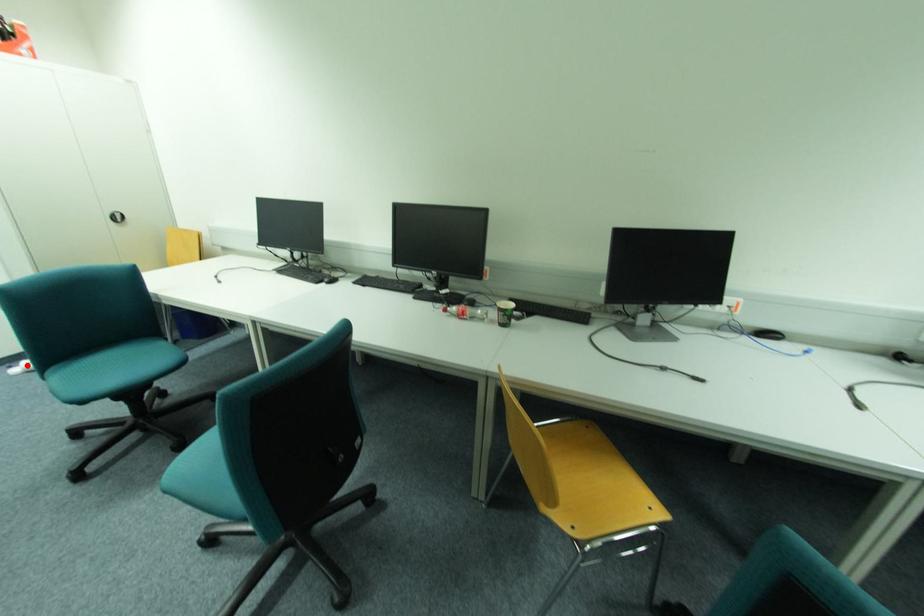
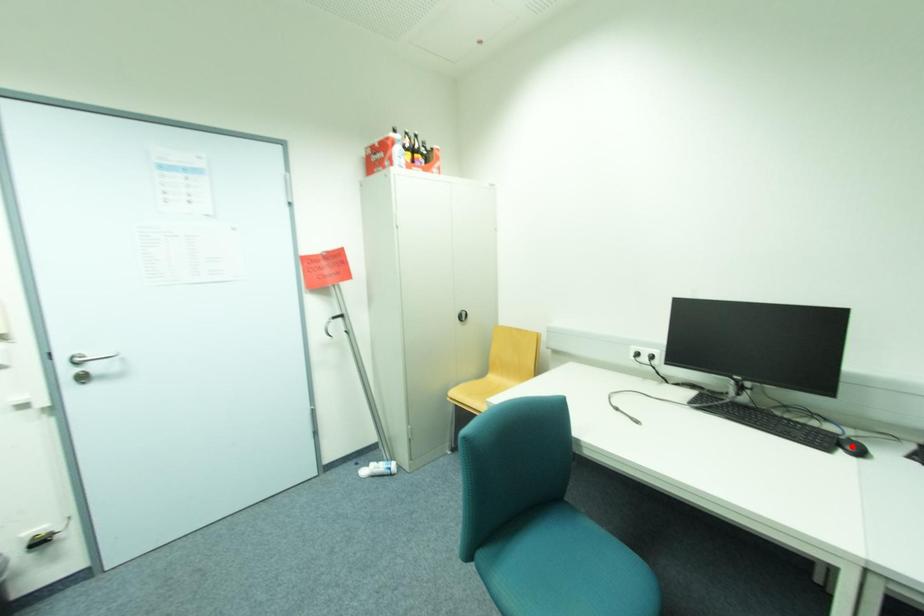
I am providing you with two images of the same scene from different viewpoints. A red point is marked on the first image and another point is marked on the second image. Is the marked point in image1 the same physical position as the marked point in image2?

No